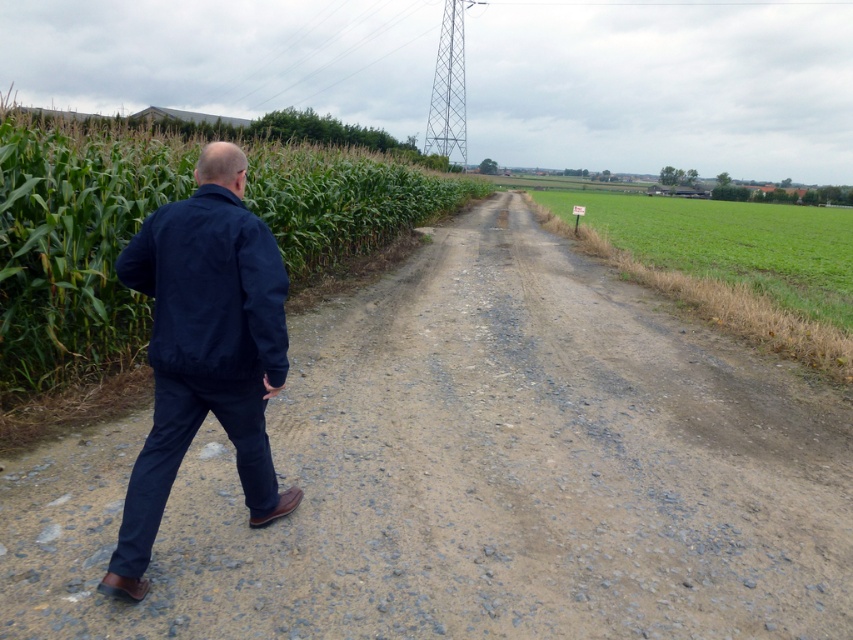
Question: Is dull gray gravel at center in front of navy blue jacket at left?

Choices:
 (A) yes
 (B) no

Answer: (A)

Question: Among these objects, which one is farthest from the camera?

Choices:
 (A) navy blue jacket at left
 (B) green leafy corn at left
 (C) green grassy field at center

Answer: (C)

Question: Does dull gray gravel at center appear under navy blue jacket at left?

Choices:
 (A) no
 (B) yes

Answer: (A)

Question: Which of the following is the farthest from the observer?

Choices:
 (A) (708, 314)
 (B) (735, 524)

Answer: (A)

Question: Estimate the real-world distances between objects in this image. Which object is farther from the navy blue jacket at left?

Choices:
 (A) navy blue fabric jacket at left
 (B) green grassy field at center
 (C) green leafy corn at left

Answer: (B)

Question: Is dull gray gravel at center bigger than green leafy corn at left?

Choices:
 (A) yes
 (B) no

Answer: (B)